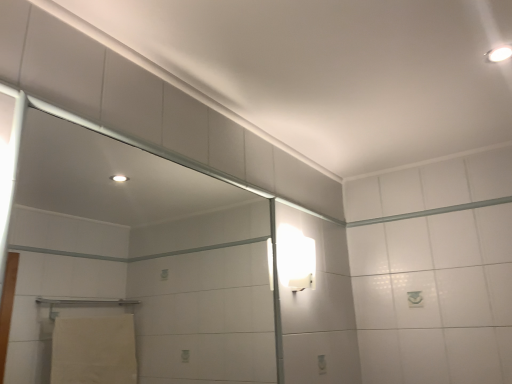
The width and height of the screenshot is (512, 384). Describe the element at coordinates (499, 54) in the screenshot. I see `white glossy light fixture at upper right, which is the second light fixture in left-to-right order` at that location.

This screenshot has height=384, width=512. Describe the element at coordinates (140, 256) in the screenshot. I see `transparent glass screen door at upper left` at that location.

This screenshot has width=512, height=384. Identify the location of white glossy light fixture at upper right, which is the first light fixture from front to back. (499, 54).

Is white glossy light fixture at upper right, which appears as the 2th light fixture when viewed from the back, oriented towards white glossy wall sconce at upper right, which is counted as the 2th light fixture, starting from the front?

No, white glossy light fixture at upper right, which appears as the 2th light fixture when viewed from the back, does not turn towards white glossy wall sconce at upper right, which is counted as the 2th light fixture, starting from the front.

Is white glossy light fixture at upper right, the second light fixture from the bottom, far away from white glossy wall sconce at upper right, positioned as the first light fixture in bottom-to-top order?

No.

Considering the sizes of objects white glossy light fixture at upper right, which appears as the 2th light fixture when viewed from the back, and white glossy wall sconce at upper right, the 1th light fixture positioned from the back, in the image provided, who is bigger, white glossy light fixture at upper right, which appears as the 2th light fixture when viewed from the back, or white glossy wall sconce at upper right, the 1th light fixture positioned from the back,?

white glossy wall sconce at upper right, the 1th light fixture positioned from the back.

Is white glossy light fixture at upper right, which is the first light fixture from front to back, further to camera compared to white glossy wall sconce at upper right, which is counted as the second light fixture, starting from the right?

No, white glossy light fixture at upper right, which is the first light fixture from front to back, is closer to the camera.

Choose the correct answer: Is white glossy light fixture at upper right, which appears as the 2th light fixture when viewed from the back, inside transparent glass screen door at upper left or outside it?

white glossy light fixture at upper right, which appears as the 2th light fixture when viewed from the back, lies outside transparent glass screen door at upper left.

Identify the location of screen door below the white glossy light fixture at upper right, the second light fixture from the bottom (from a real-world perspective). This screenshot has width=512, height=384. (140, 256).

Is transparent glass screen door at upper left positioned far away from white glossy light fixture at upper right, which is the first light fixture from front to back?

Indeed, transparent glass screen door at upper left is not near white glossy light fixture at upper right, which is the first light fixture from front to back.

From a real-world perspective, does transparent glass screen door at upper left stand above white glossy light fixture at upper right, which appears as the 2th light fixture when viewed from the back?

No, from a real-world perspective, transparent glass screen door at upper left is not over white glossy light fixture at upper right, which appears as the 2th light fixture when viewed from the back

From the image's perspective, relative to white glossy light fixture at upper right, which appears as the 2th light fixture when viewed from the back, is transparent glass screen door at upper left above or below?

transparent glass screen door at upper left is situated lower than white glossy light fixture at upper right, which appears as the 2th light fixture when viewed from the back, in the image.

Between transparent glass screen door at upper left and white glossy light fixture at upper right, the first light fixture positioned from the top, which one has less height?

white glossy light fixture at upper right, the first light fixture positioned from the top, is shorter.

In the image, is white glossy wall sconce at upper right, which is the 1th light fixture from left to right, positioned in front of or behind white glossy light fixture at upper right, the second light fixture from the bottom?

white glossy wall sconce at upper right, which is the 1th light fixture from left to right, is positioned farther from the viewer than white glossy light fixture at upper right, the second light fixture from the bottom.

Is white glossy wall sconce at upper right, which is the 1th light fixture from left to right, thinner than white glossy light fixture at upper right, which appears as the 2th light fixture when viewed from the back?

Yes, white glossy wall sconce at upper right, which is the 1th light fixture from left to right, is thinner than white glossy light fixture at upper right, which appears as the 2th light fixture when viewed from the back.

Are white glossy wall sconce at upper right, arranged as the second light fixture when viewed from the top, and white glossy light fixture at upper right, which is the second light fixture in left-to-right order, making contact?

No, white glossy wall sconce at upper right, arranged as the second light fixture when viewed from the top, is not touching white glossy light fixture at upper right, which is the second light fixture in left-to-right order.

Can you tell me how much white glossy wall sconce at upper right, arranged as the second light fixture when viewed from the top, and white glossy light fixture at upper right, the second light fixture from the bottom, differ in facing direction?

The angle between the facing direction of white glossy wall sconce at upper right, arranged as the second light fixture when viewed from the top, and the facing direction of white glossy light fixture at upper right, the second light fixture from the bottom, is 85.8 degrees.

Is white glossy wall sconce at upper right, positioned as the first light fixture in bottom-to-top order, turned away from transparent glass screen door at upper left?

No.

Is the surface of white glossy wall sconce at upper right, arranged as the second light fixture when viewed from the top, in direct contact with transparent glass screen door at upper left?

No, white glossy wall sconce at upper right, arranged as the second light fixture when viewed from the top, is not beside transparent glass screen door at upper left.

Is transparent glass screen door at upper left located within white glossy wall sconce at upper right, which is counted as the 2th light fixture, starting from the front?

Actually, transparent glass screen door at upper left is outside white glossy wall sconce at upper right, which is counted as the 2th light fixture, starting from the front.

From the image's perspective, is white glossy wall sconce at upper right, the 1th light fixture positioned from the back, located above transparent glass screen door at upper left?

No, from the image's perspective, white glossy wall sconce at upper right, the 1th light fixture positioned from the back, is not above transparent glass screen door at upper left.

Is point (105, 162) positioned after point (290, 244)?

That is True.

Between transparent glass screen door at upper left and white glossy wall sconce at upper right, which is counted as the second light fixture, starting from the right, which one has less height?

white glossy wall sconce at upper right, which is counted as the second light fixture, starting from the right.

Considering the relative sizes of transparent glass screen door at upper left and white glossy wall sconce at upper right, which is counted as the 2th light fixture, starting from the front, in the image provided, is transparent glass screen door at upper left thinner than white glossy wall sconce at upper right, which is counted as the 2th light fixture, starting from the front,?

Indeed, transparent glass screen door at upper left has a lesser width compared to white glossy wall sconce at upper right, which is counted as the 2th light fixture, starting from the front.

This screenshot has height=384, width=512. I want to click on light fixture below the white glossy light fixture at upper right, which is the first light fixture from front to back (from the image's perspective), so click(295, 258).

I want to click on the 1st light fixture behind the transparent glass screen door at upper left, so click(x=499, y=54).

When comparing their distances from white glossy wall sconce at upper right, which is counted as the 2th light fixture, starting from the front, does transparent glass screen door at upper left or white glossy light fixture at upper right, which appears as the 2th light fixture when viewed from the back, seem further?

transparent glass screen door at upper left is positioned further to the anchor white glossy wall sconce at upper right, which is counted as the 2th light fixture, starting from the front.

From the picture: Based on their spatial positions, is transparent glass screen door at upper left or white glossy wall sconce at upper right, positioned as the first light fixture in bottom-to-top order, further from white glossy light fixture at upper right, the 1th light fixture viewed from the right?

The object further to white glossy light fixture at upper right, the 1th light fixture viewed from the right, is transparent glass screen door at upper left.

Considering their positions, is white glossy wall sconce at upper right, positioned as the first light fixture in bottom-to-top order, positioned further to white glossy light fixture at upper right, which appears as the 2th light fixture when viewed from the back, than transparent glass screen door at upper left?

transparent glass screen door at upper left is positioned further to the anchor white glossy light fixture at upper right, which appears as the 2th light fixture when viewed from the back.

Considering their positions, is white glossy light fixture at upper right, which is the second light fixture in left-to-right order, positioned closer to white glossy wall sconce at upper right, which is the 1th light fixture from left to right, than transparent glass screen door at upper left?

white glossy light fixture at upper right, which is the second light fixture in left-to-right order, lies closer to white glossy wall sconce at upper right, which is the 1th light fixture from left to right, than the other object.

When comparing their distances from transparent glass screen door at upper left, does white glossy light fixture at upper right, which is the second light fixture in left-to-right order, or white glossy wall sconce at upper right, the 1th light fixture positioned from the back, seem closer?

white glossy wall sconce at upper right, the 1th light fixture positioned from the back, is closer to transparent glass screen door at upper left.

When comparing their distances from transparent glass screen door at upper left, does white glossy wall sconce at upper right, the 1th light fixture positioned from the back, or white glossy light fixture at upper right, which is the second light fixture in left-to-right order, seem further?

The object further to transparent glass screen door at upper left is white glossy light fixture at upper right, which is the second light fixture in left-to-right order.

Identify the location of light fixture situated between transparent glass screen door at upper left and white glossy light fixture at upper right, which appears as the 2th light fixture when viewed from the back, from left to right. (295, 258).